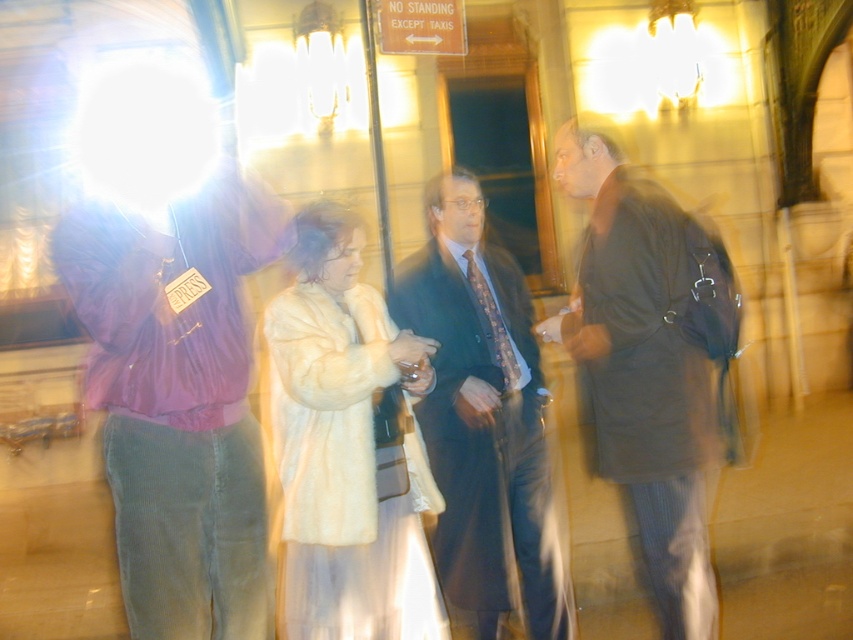
Question: Can you confirm if dark brown leather coat at center is wider than dark suit at center?

Choices:
 (A) yes
 (B) no

Answer: (B)

Question: Is purple corduroy jacket at left smaller than dark suit at center?

Choices:
 (A) yes
 (B) no

Answer: (A)

Question: Which of these objects is positioned closest to the fuzzy white fur coat at center?

Choices:
 (A) dark suit at center
 (B) purple corduroy jacket at left
 (C) dark brown leather coat at center

Answer: (B)

Question: Is the position of dark brown leather coat at center less distant than that of fuzzy white fur coat at center?

Choices:
 (A) yes
 (B) no

Answer: (B)

Question: Which object is farther from the camera taking this photo?

Choices:
 (A) fuzzy white fur coat at center
 (B) purple corduroy jacket at left

Answer: (A)

Question: Which point appears closest to the camera in this image?

Choices:
 (A) (467, 442)
 (B) (105, 330)
 (C) (369, 372)

Answer: (B)